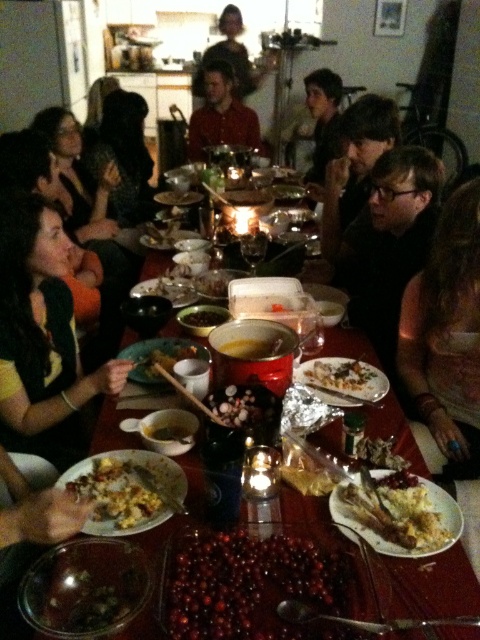
You are sitting at the dining table and want to reach for the yellow matte bowl at center without disturbing the blonde hair at upper center. Is this possible?

The blonde hair at upper center is positioned over the yellow matte bowl at center, so reaching for the yellow matte bowl at center might disturb the blonde hair unless you carefully move around it.

You are a guest at this gathering and want to reach for the yellow matte bowl at center without disturbing the person with blonde hair at upper center. Considering their heights, can you safely do so?

The blonde hair at upper center is taller than the yellow matte bowl at center, so you can safely reach for the yellow matte bowl at center without disturbing the person as it is shorter.

You are a guest at this gathering and want to reach for the shiny red grapes at center without disturbing the green knitted sweater at left. Which direction should you move your hand to grab the grapes?

You should move your hand to the right from the green knitted sweater at left to reach the shiny red grapes at center since the sweater is to the left of the grapes.